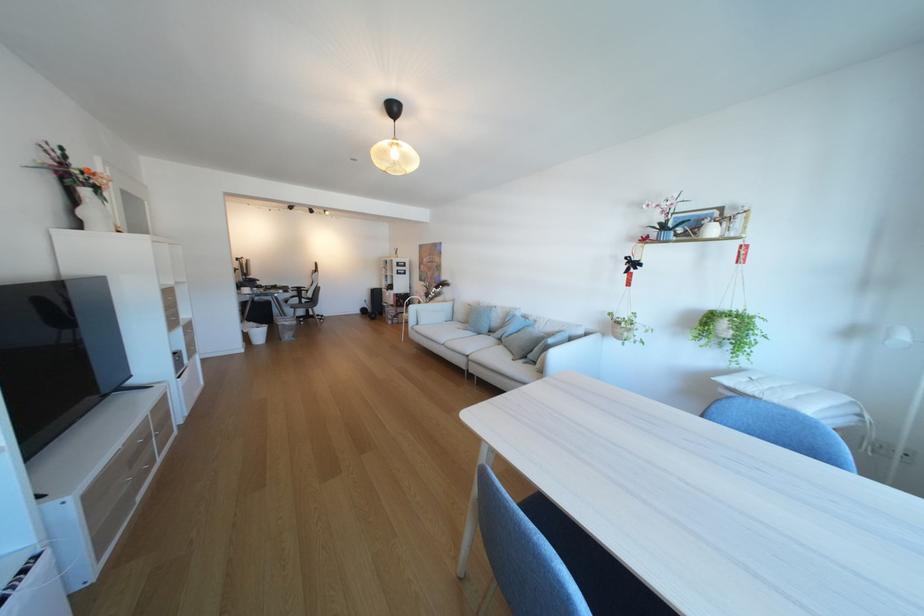
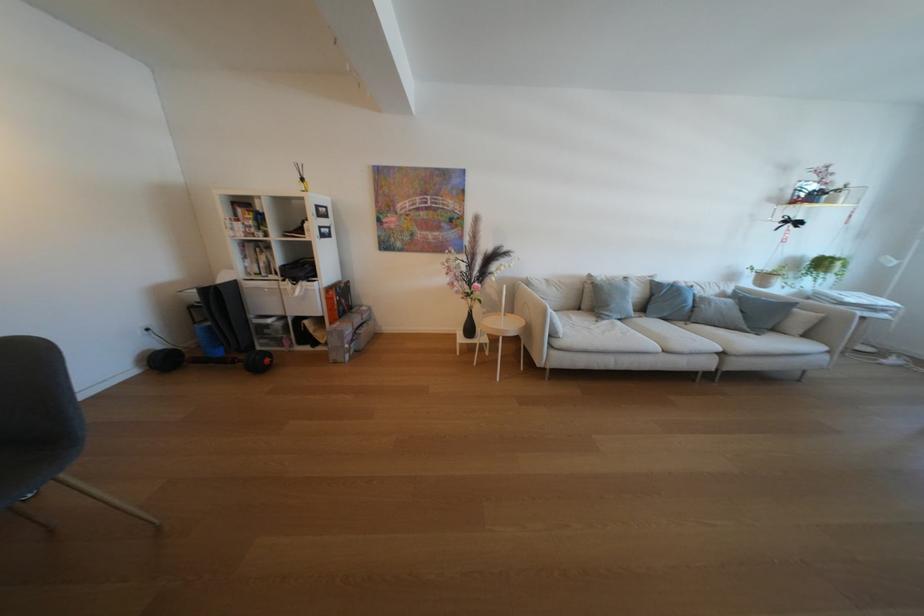
Find the pixel in the second image that matches pixel 496 306 in the first image.

(614, 278)